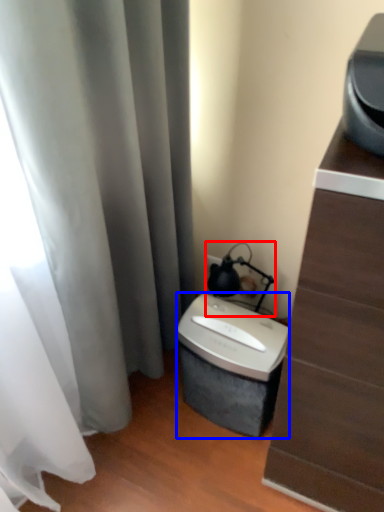
Question: Which object is closer to the camera taking this photo, table lamp (highlighted by a red box) or appliance (highlighted by a blue box)?

Choices:
 (A) table lamp
 (B) appliance

Answer: (B)